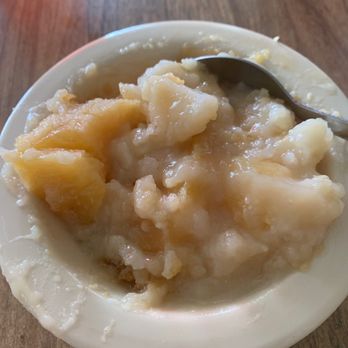
At what (x,y) coordinates should I click in order to perform the action: click on handle. Please return your answer as a coordinate pair (x, y). The height and width of the screenshot is (348, 348). Looking at the image, I should click on (x=343, y=128).